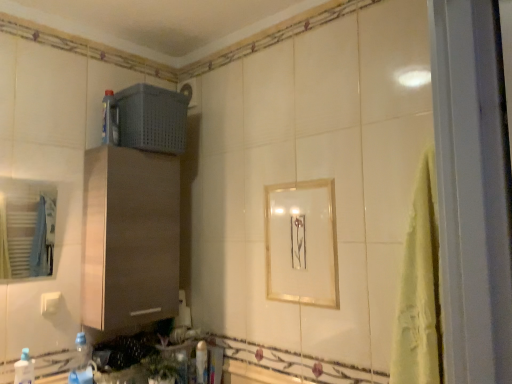
Question: From a real-world perspective, is translucent plastic bottle at upper left, placed as the 2th bottle when sorted from right to left, above or below white glossy bottle at lower center, which is the first bottle in bottom-to-top order?

Choices:
 (A) above
 (B) below

Answer: (A)

Question: Based on their sizes in the image, would you say translucent plastic bottle at upper left, arranged as the third bottle when viewed from the left, is bigger or smaller than white glossy bottle at lower center, which is the first bottle in bottom-to-top order?

Choices:
 (A) small
 (B) big

Answer: (B)

Question: Estimate the real-world distances between objects in this image. Which object is closer to the gray plastic basket at upper center?

Choices:
 (A) gold metallic picture frame at center
 (B) translucent plastic bottle at lower left, the 1th bottle in the left-to-right sequence
 (C) white glossy bottle at lower center, the fourth bottle when ordered from top to bottom
 (D) blue plastic bottle at lower left, the 3th bottle in the top-to-bottom sequence
 (E) matte white towel rack at left

Answer: (A)

Question: Which of these objects is positioned closest to the white plastic electric outlet at lower left?

Choices:
 (A) blue plastic bottle at lower left, the 2th bottle in the left-to-right sequence
 (B) brushed wood cabinet at center
 (C) white glossy bath at lower center
 (D) white glossy bottle at lower center, acting as the fourth bottle starting from the front
 (E) gold metallic picture frame at center

Answer: (A)